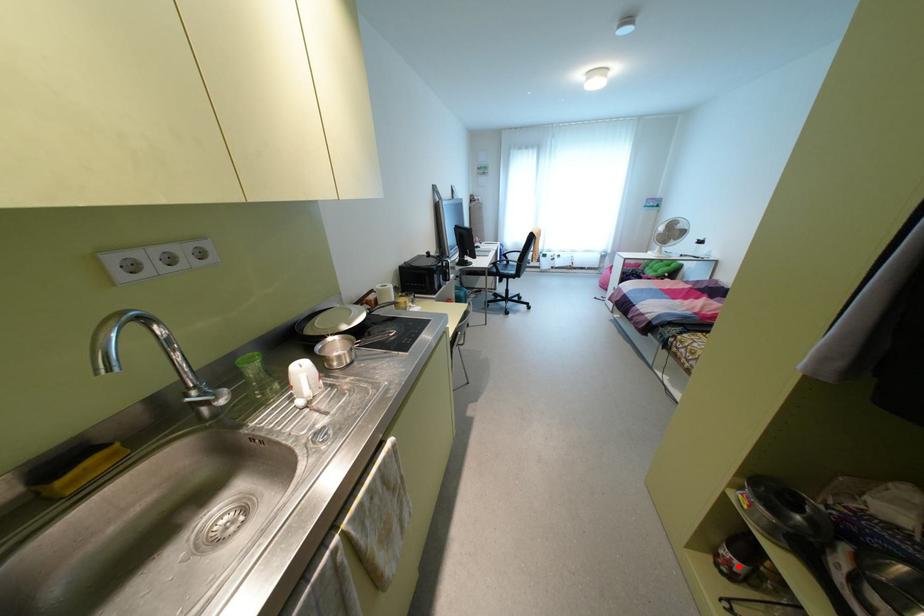
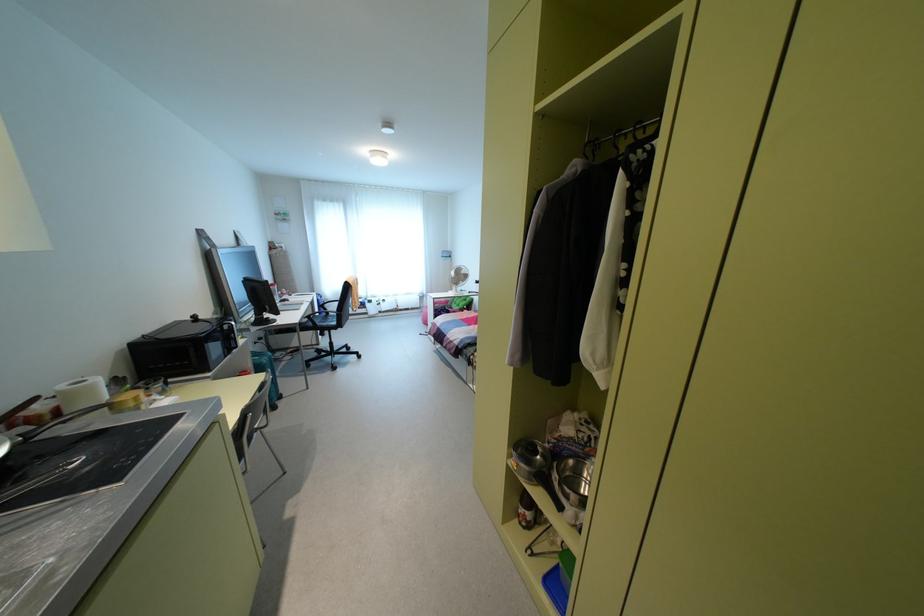
Question: A red point is marked in image1. In image2, is the corresponding 3D point closer to the camera or farther? Reply with the corresponding letter.

Choices:
 (A) The corresponding 3D point is closer.
 (B) The corresponding 3D point is farther.

Answer: (B)